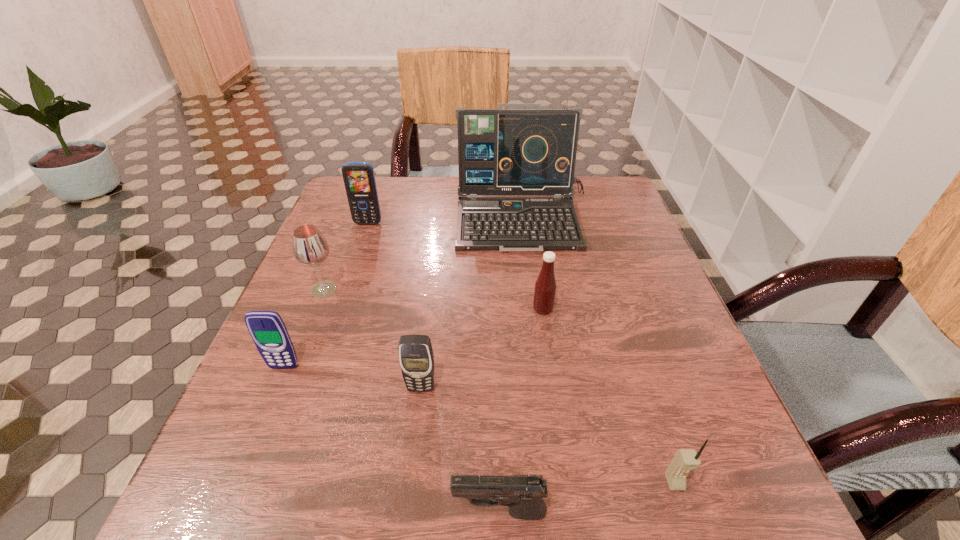
In the image, there is a desktop. Where is `free space at the far edge`? The width and height of the screenshot is (960, 540). free space at the far edge is located at coordinates (422, 213).

Locate an element on the screen. The image size is (960, 540). free space at the near edge of the desktop is located at coordinates (338, 492).

Where is `vacant area at the left edge of the desktop`? The width and height of the screenshot is (960, 540). vacant area at the left edge of the desktop is located at coordinates (273, 458).

In the image, there is a desktop. What are the coordinates of `free space at the right edge` in the screenshot? It's located at (653, 419).

At what (x,y) coordinates should I click in order to perform the action: click on blank area at the far left corner. Please return your answer as a coordinate pair (x, y). The image size is (960, 540). Looking at the image, I should click on (380, 204).

Image resolution: width=960 pixels, height=540 pixels. In the image, there is a desktop. In order to click on vacant area at the far right corner in this screenshot , I will do click(x=605, y=197).

This screenshot has width=960, height=540. Find the location of `free space at the near right corner of the desktop`. free space at the near right corner of the desktop is located at coordinates (655, 500).

The height and width of the screenshot is (540, 960). I want to click on free spot between the pistol and the second farthest cellular telephone, so (392, 440).

Identify the location of free space between the second nearest object and the third farthest object. (499, 386).

In order to click on empty space that is in between the wineglass and the laptop computer in this screenshot , I will do coord(423,255).